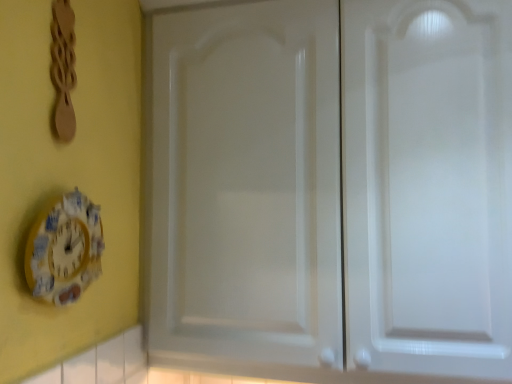
Question: Is wooden spoon at upper left positioned before white glossy cabinet doors at center?

Choices:
 (A) yes
 (B) no

Answer: (A)

Question: Considering the relative sizes of wooden spoon at upper left and white glossy cabinet doors at center in the image provided, is wooden spoon at upper left smaller than white glossy cabinet doors at center?

Choices:
 (A) no
 (B) yes

Answer: (B)

Question: Could you tell me if wooden spoon at upper left is turned towards white glossy cabinet doors at center?

Choices:
 (A) yes
 (B) no

Answer: (B)

Question: From a real-world perspective, does wooden spoon at upper left stand above white glossy cabinet doors at center?

Choices:
 (A) yes
 (B) no

Answer: (A)

Question: Considering the relative sizes of wooden spoon at upper left and white glossy cabinet doors at center in the image provided, is wooden spoon at upper left taller than white glossy cabinet doors at center?

Choices:
 (A) yes
 (B) no

Answer: (B)

Question: From their relative heights in the image, would you say yellow painted wood clock at lower left is taller or shorter than wooden spoon at upper left?

Choices:
 (A) short
 (B) tall

Answer: (A)

Question: From the image's perspective, relative to wooden spoon at upper left, is yellow painted wood clock at lower left above or below?

Choices:
 (A) above
 (B) below

Answer: (B)

Question: In the image, is yellow painted wood clock at lower left on the left side or the right side of wooden spoon at upper left?

Choices:
 (A) right
 (B) left

Answer: (A)

Question: Considering the positions of point (69, 225) and point (73, 127), is point (69, 225) closer or farther from the camera than point (73, 127)?

Choices:
 (A) farther
 (B) closer

Answer: (B)

Question: Based on their positions, is wooden spoon at upper left located to the left or right of yellow painted wood clock at lower left?

Choices:
 (A) right
 (B) left

Answer: (B)

Question: Considering the positions of wooden spoon at upper left and yellow painted wood clock at lower left in the image, is wooden spoon at upper left wider or thinner than yellow painted wood clock at lower left?

Choices:
 (A) wide
 (B) thin

Answer: (B)

Question: Is point (57, 31) positioned closer to the camera than point (84, 256)?

Choices:
 (A) farther
 (B) closer

Answer: (B)

Question: From a real-world perspective, is wooden spoon at upper left above or below yellow painted wood clock at lower left?

Choices:
 (A) above
 (B) below

Answer: (A)

Question: Looking at the image, does wooden spoon at upper left seem bigger or smaller compared to white glossy cabinet doors at center?

Choices:
 (A) small
 (B) big

Answer: (A)

Question: From the image's perspective, is wooden spoon at upper left located above or below white glossy cabinet doors at center?

Choices:
 (A) above
 (B) below

Answer: (A)